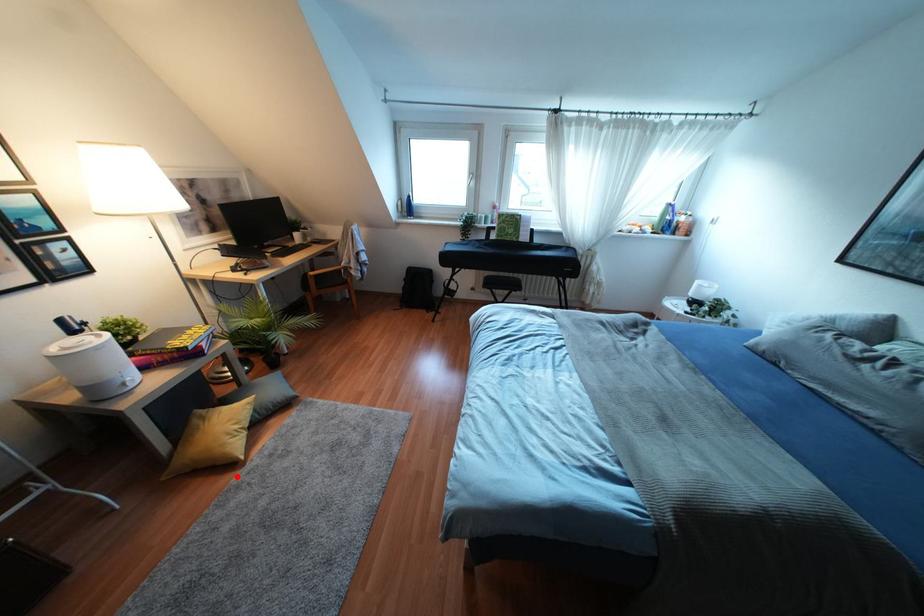
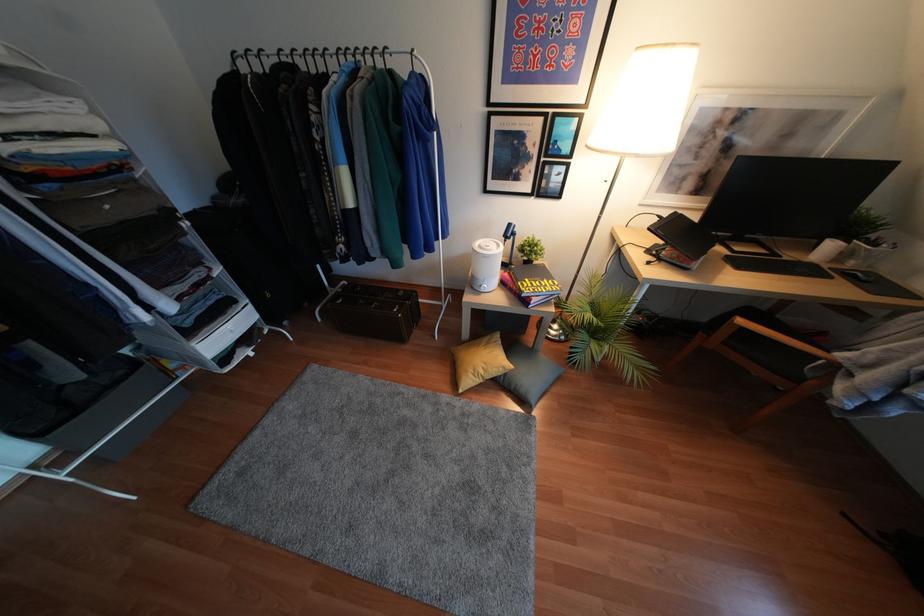
Question: A red point is marked in image1. In image2, is the corresponding 3D point closer to the camera or farther? Reply with the corresponding letter.

Choices:
 (A) The corresponding 3D point is closer.
 (B) The corresponding 3D point is farther.

Answer: (A)